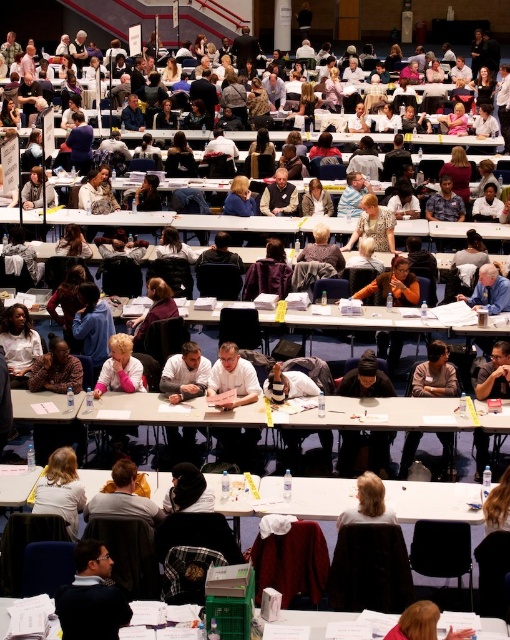
Question: Can you confirm if blonde hair at lower left is positioned above blonde hair at center?

Choices:
 (A) yes
 (B) no

Answer: (A)

Question: Does blonde hair at lower left appear over blonde hair at center?

Choices:
 (A) yes
 (B) no

Answer: (A)

Question: Can you confirm if white plastic table at center is positioned below dark blue sweater at lower left?

Choices:
 (A) yes
 (B) no

Answer: (B)

Question: Which of the following is the closest to the observer?

Choices:
 (A) blonde hair at lower left
 (B) blonde hair at center
 (C) white plastic table at center
 (D) blonde hair at lower center

Answer: (D)

Question: Which point is farther to the camera?

Choices:
 (A) (416, 625)
 (B) (103, 632)
 (C) (4, 605)

Answer: (C)

Question: Which of the following is the farthest from the observer?

Choices:
 (A) (414, 605)
 (B) (141, 403)
 (C) (391, 520)
 (D) (68, 616)

Answer: (B)